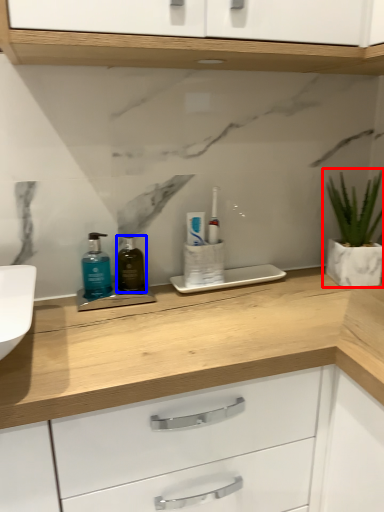
Question: Which of the following is the farthest to the observer, houseplant (highlighted by a red box) or mouthwash (highlighted by a blue box)?

Choices:
 (A) houseplant
 (B) mouthwash

Answer: (A)